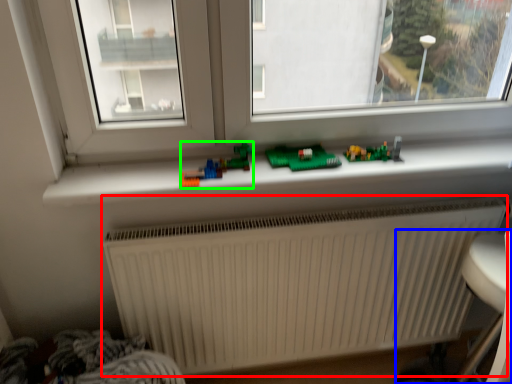
Question: Estimate the real-world distances between objects in this image. Which object is farther from radiator (highlighted by a red box), armchair (highlighted by a blue box) or toy (highlighted by a green box)?

Choices:
 (A) armchair
 (B) toy

Answer: (B)